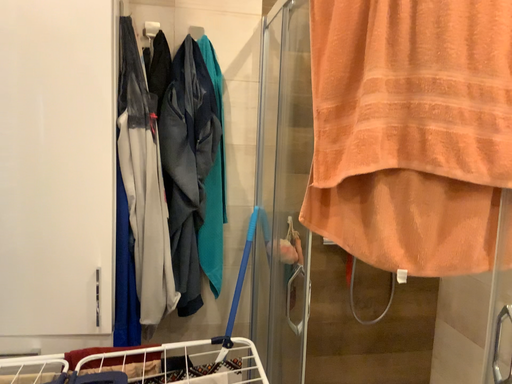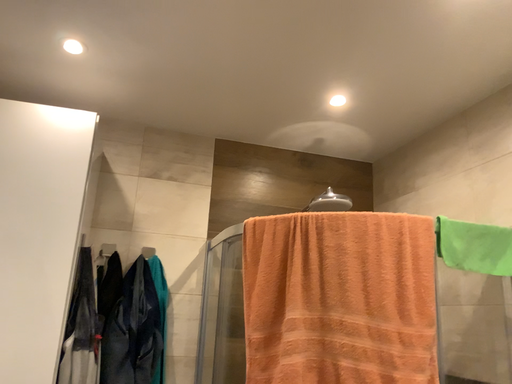
Question: Which way did the camera rotate in the video?

Choices:
 (A) rotated left
 (B) rotated right

Answer: (B)